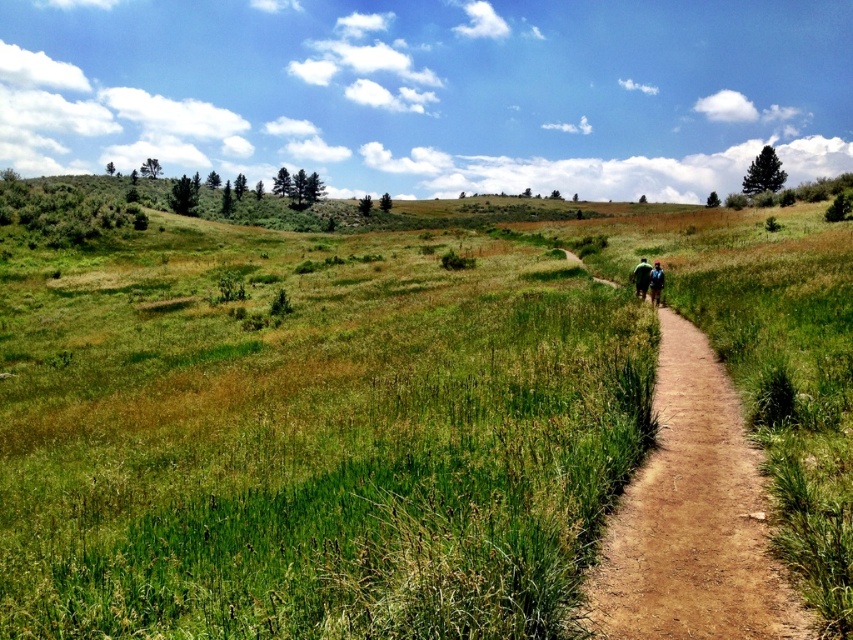
You are standing at the origin point of the coordinate system in the image. You want to walk towards the green grass at center. In which direction should you move based on the coordinate system?

The green grass at center is located at coordinate point 0.659 on the x axis and 0.455 on the y axis. Since you are at the origin, you should move towards the positive x and positive y direction to reach the green grass at center.

You are a hiker with a 20 meter rope. You want to cross from the green grass at center to the brown dirt path at center. Can you use your rope to reach the path?

The distance between green grass at center and brown dirt path at center is 19.43 meters, so yes, the 20 meter rope is long enough to reach the path.